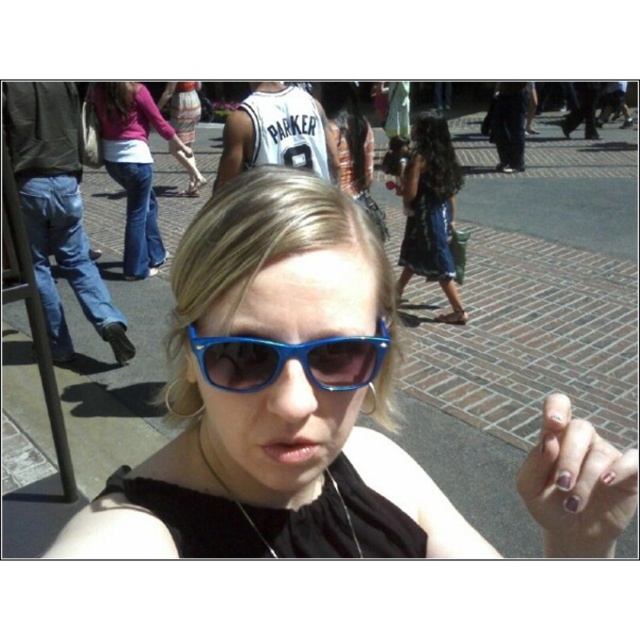
Between point (544, 444) and point (140, 141), which one is positioned in front?

Point (544, 444) is in front.

Who is positioned more to the left, purple painted nails at center or jeans at center?

jeans at center

Which is in front, point (550, 547) or point (141, 208)?

Positioned in front is point (550, 547).

Find the location of a particular element. The width and height of the screenshot is (640, 640). purple painted nails at center is located at coordinates [577, 484].

Can you confirm if shiny blue sunglasses at center is positioned below purple painted nails at center?

Incorrect, shiny blue sunglasses at center is not positioned below purple painted nails at center.

Can you confirm if shiny blue sunglasses at center is positioned above purple painted nails at center?

Yes.

Is point (180, 355) positioned before point (588, 525)?

No.

I want to click on shiny blue sunglasses at center, so click(x=284, y=356).

Does jeans at left appear under blue plastic sunglasses at center?

Actually, jeans at left is above blue plastic sunglasses at center.

Which is in front, point (61, 320) or point (317, 356)?

Positioned in front is point (317, 356).

At what (x,y) coordinates should I click in order to perform the action: click on jeans at left. Please return your answer as a coordinate pair (x, y). The height and width of the screenshot is (640, 640). Looking at the image, I should click on (56, 208).